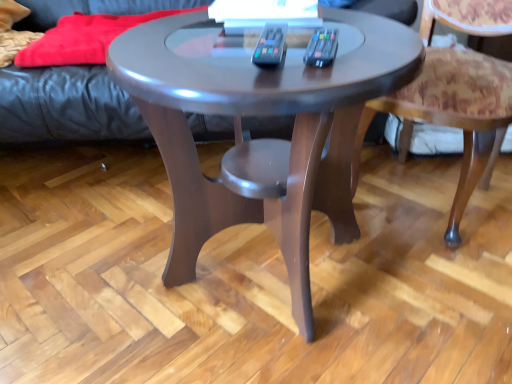
Question: Is glossy wood coffee table at center far from leather couch at upper left?

Choices:
 (A) no
 (B) yes

Answer: (A)

Question: From a real-world perspective, is glossy wood coffee table at center positioned over leather couch at upper left based on gravity?

Choices:
 (A) no
 (B) yes

Answer: (A)

Question: From the image's perspective, does glossy wood coffee table at center appear lower than leather couch at upper left?

Choices:
 (A) yes
 (B) no

Answer: (A)

Question: Does glossy wood coffee table at center have a greater height compared to leather couch at upper left?

Choices:
 (A) no
 (B) yes

Answer: (B)

Question: Does glossy wood coffee table at center have a larger size compared to leather couch at upper left?

Choices:
 (A) no
 (B) yes

Answer: (A)

Question: Is glossy wood coffee table at center outside leather couch at upper left?

Choices:
 (A) yes
 (B) no

Answer: (A)

Question: Does patterned fabric chair at lower right have a larger size compared to glossy wood coffee table at center?

Choices:
 (A) yes
 (B) no

Answer: (B)

Question: Does patterned fabric chair at lower right appear on the left side of glossy wood coffee table at center?

Choices:
 (A) no
 (B) yes

Answer: (A)

Question: Is patterned fabric chair at lower right taller than glossy wood coffee table at center?

Choices:
 (A) yes
 (B) no

Answer: (A)

Question: Can you confirm if patterned fabric chair at lower right is smaller than glossy wood coffee table at center?

Choices:
 (A) yes
 (B) no

Answer: (A)

Question: From the image's perspective, is patterned fabric chair at lower right below glossy wood coffee table at center?

Choices:
 (A) no
 (B) yes

Answer: (A)

Question: Is glossy wood coffee table at center surrounded by patterned fabric chair at lower right?

Choices:
 (A) yes
 (B) no

Answer: (B)

Question: From the image's perspective, is glossy wood coffee table at center on patterned fabric chair at lower right?

Choices:
 (A) no
 (B) yes

Answer: (A)